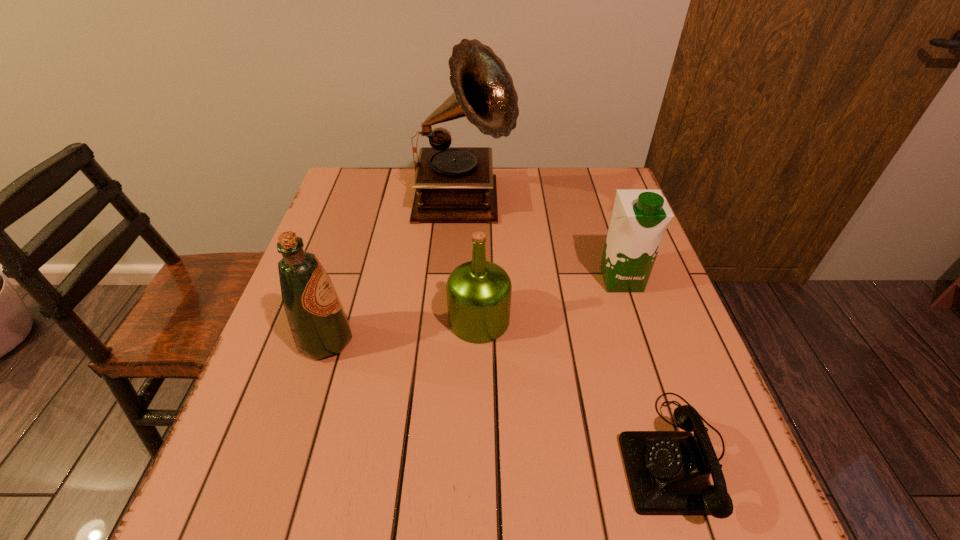
The width and height of the screenshot is (960, 540). In order to click on vacant space positioned 0.180m on the front-facing side of the soya milk in this screenshot , I will do `click(648, 359)`.

You are a GUI agent. You are given a task and a screenshot of the screen. Output one action in this format:
    pyautogui.click(x=<x>, y=<y>)
    Task: Click on the free space located on the front of the shorter olive oil
    The height and width of the screenshot is (540, 960).
    Given the screenshot: What is the action you would take?
    pyautogui.click(x=479, y=485)

The height and width of the screenshot is (540, 960). I want to click on free location located on the front face of the telephone, so click(x=495, y=455).

The height and width of the screenshot is (540, 960). What are the coordinates of `vacant space located on the front face of the telephone` in the screenshot? It's located at (415, 455).

Identify the location of vacant space located 0.180m on the front face of the telephone. (518, 455).

You are a GUI agent. You are given a task and a screenshot of the screen. Output one action in this format:
    pyautogui.click(x=<x>, y=<y>)
    Task: Click on the object situated at the far edge
    The image size is (960, 540).
    Given the screenshot: What is the action you would take?
    pyautogui.click(x=453, y=184)

Identify the location of object that is at the near edge. The image size is (960, 540). (668, 472).

Where is `object that is at the left edge`? Image resolution: width=960 pixels, height=540 pixels. object that is at the left edge is located at coordinates (319, 325).

Find the location of a particular element. The image size is (960, 540). soya milk at the right edge is located at coordinates (640, 218).

This screenshot has width=960, height=540. Find the location of `telephone located in the right edge section of the desktop`. telephone located in the right edge section of the desktop is located at coordinates (668, 472).